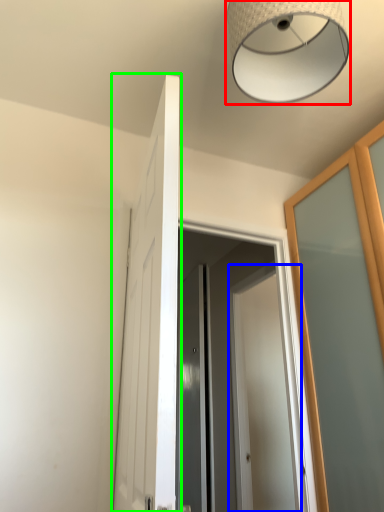
Question: Estimate the real-world distances between objects in this image. Which object is farther from lamp (highlighted by a red box), door (highlighted by a blue box) or door (highlighted by a green box)?

Choices:
 (A) door
 (B) door

Answer: (A)